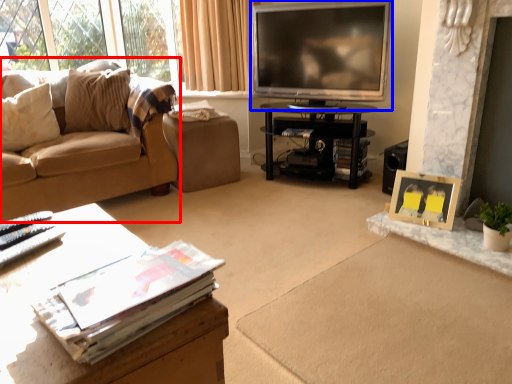
Question: Among these objects, which one is farthest to the camera, studio couch (highlighted by a red box) or television (highlighted by a blue box)?

Choices:
 (A) studio couch
 (B) television

Answer: (B)